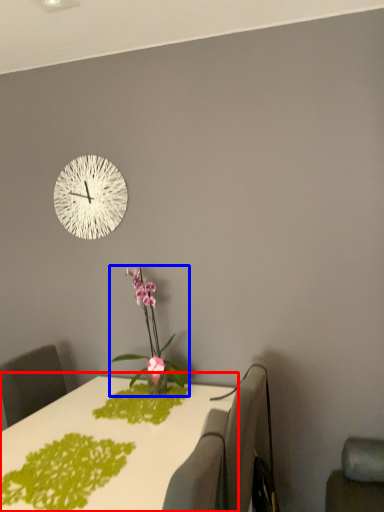
Question: Which point is further to the camera, table (highlighted by a red box) or houseplant (highlighted by a blue box)?

Choices:
 (A) table
 (B) houseplant

Answer: (B)